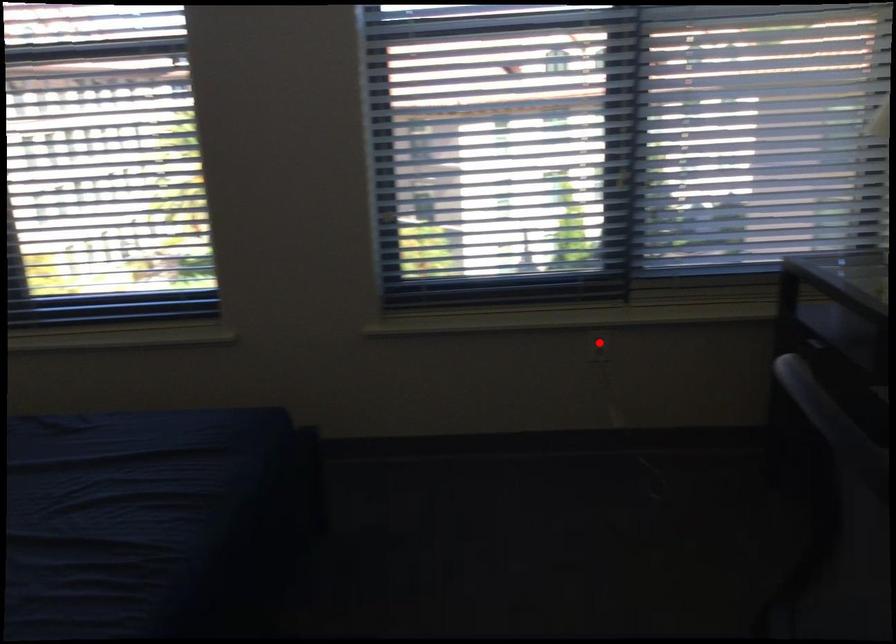
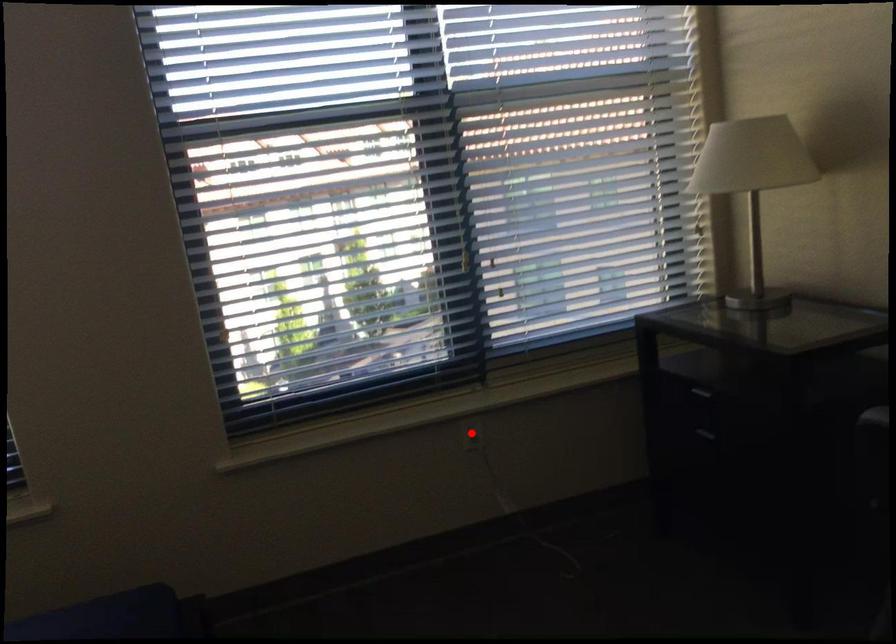
I am providing you with two images of the same scene from different viewpoints. A red point is marked on the first image and another point is marked on the second image. Does the point marked in image1 correspond to the same location as the one in image2?

Yes